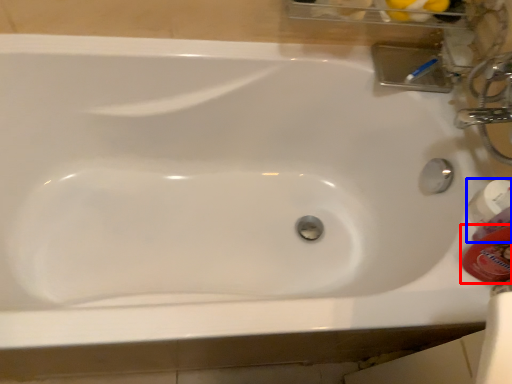
Question: Among these objects, which one is farthest to the camera, mouthwash (highlighted by a red box) or mouthwash (highlighted by a blue box)?

Choices:
 (A) mouthwash
 (B) mouthwash

Answer: (B)